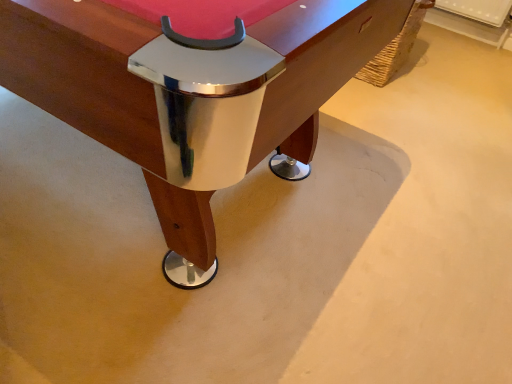
Describe the element at coordinates (189, 96) in the screenshot. This screenshot has height=384, width=512. I see `polished wood pool table at center` at that location.

Locate an element on the screen. This screenshot has width=512, height=384. polished wood pool table at center is located at coordinates (189, 96).

Identify the location of polished wood pool table at center. Image resolution: width=512 pixels, height=384 pixels. (189, 96).